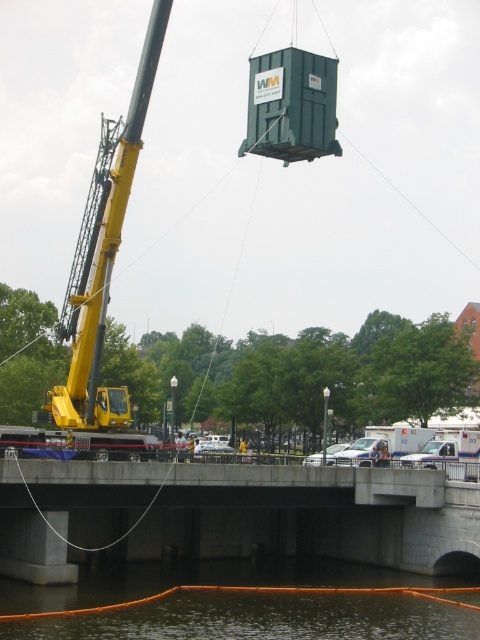
Question: Which object is closer to the camera taking this photo?

Choices:
 (A) yellow metallic crane at left
 (B) brown murky water at lower center

Answer: (B)

Question: Which point is closer to the camera?

Choices:
 (A) (47, 598)
 (B) (436, 477)
 (C) (99, 177)

Answer: (A)

Question: Does concrete bridge at center appear on the right side of yellow metallic crane at left?

Choices:
 (A) no
 (B) yes

Answer: (B)

Question: Does brown murky water at lower center appear under yellow metallic crane at left?

Choices:
 (A) no
 (B) yes

Answer: (B)

Question: Is concrete bridge at center smaller than yellow metallic crane at left?

Choices:
 (A) no
 (B) yes

Answer: (B)

Question: Which point is farther to the camera?

Choices:
 (A) concrete bridge at center
 (B) yellow metallic crane at left
 (C) brown murky water at lower center

Answer: (B)